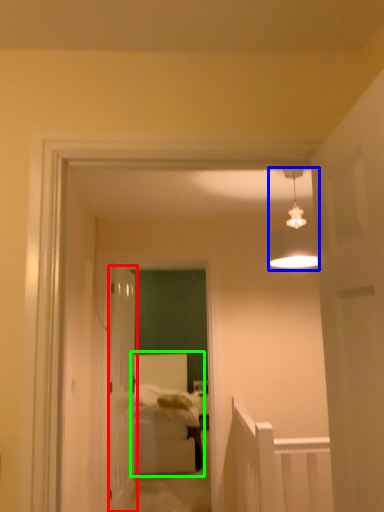
Question: Based on their relative distances, which object is farther from door (highlighted by a red box)? Choose from light fixture (highlighted by a blue box) and bed (highlighted by a green box).

Choices:
 (A) light fixture
 (B) bed

Answer: (A)